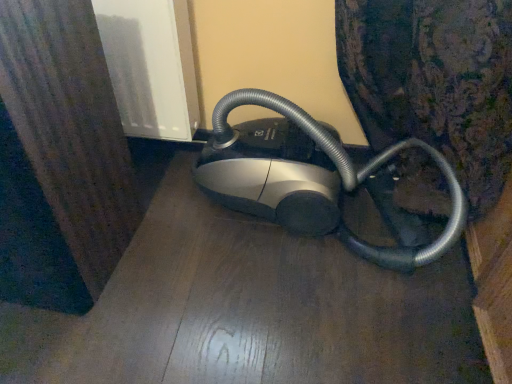
Where is `vacant region in front of silver metallic vacuum cleaner at center`? vacant region in front of silver metallic vacuum cleaner at center is located at coordinates (312, 327).